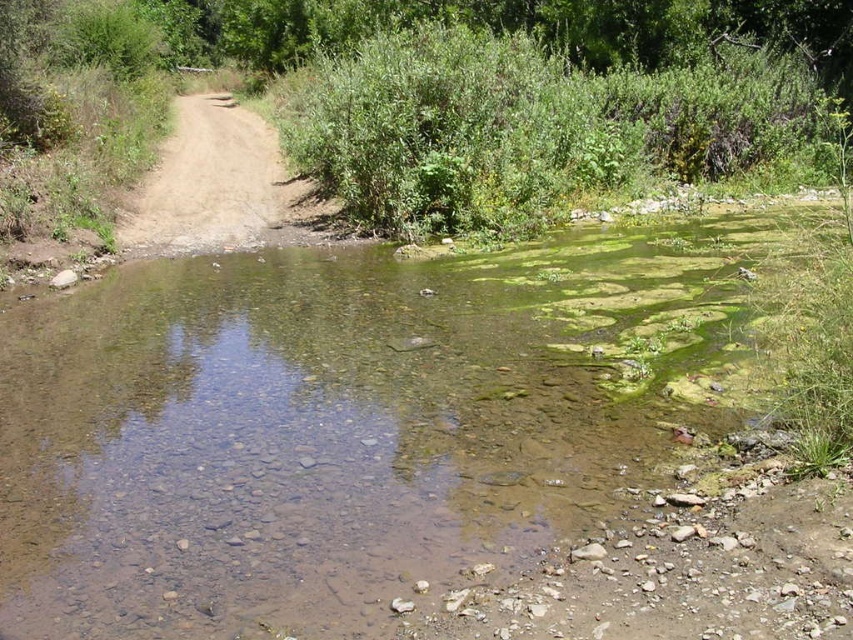
Question: Does green algae-covered water at center come behind green mossy algae at upper right?

Choices:
 (A) yes
 (B) no

Answer: (B)

Question: Is green algae-covered water at center below green mossy algae at upper right?

Choices:
 (A) yes
 (B) no

Answer: (A)

Question: Which object is the closest to the green algae-covered water at center?

Choices:
 (A) dirt road at center
 (B) green mossy algae at upper right

Answer: (B)

Question: Which of these objects is positioned closest to the green algae-covered water at center?

Choices:
 (A) dirt road at center
 (B) green mossy algae at upper right

Answer: (B)

Question: Does green algae-covered water at center have a larger size compared to green mossy algae at upper right?

Choices:
 (A) yes
 (B) no

Answer: (B)

Question: Which of the following is the closest to the observer?

Choices:
 (A) dirt road at center
 (B) green algae-covered water at center
 (C) green mossy algae at upper right

Answer: (B)